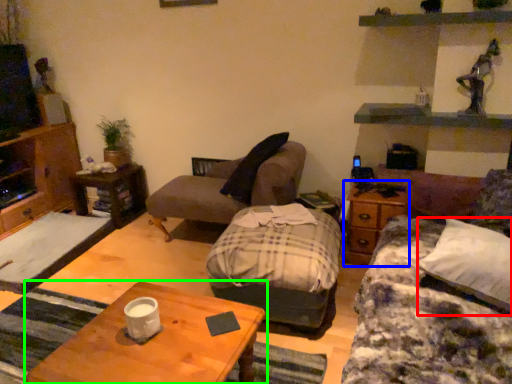
Question: Based on their relative distances, which object is farther from pillow (highlighted by a red box)? Choose from side table (highlighted by a blue box) and coffee table (highlighted by a green box).

Choices:
 (A) side table
 (B) coffee table

Answer: (B)